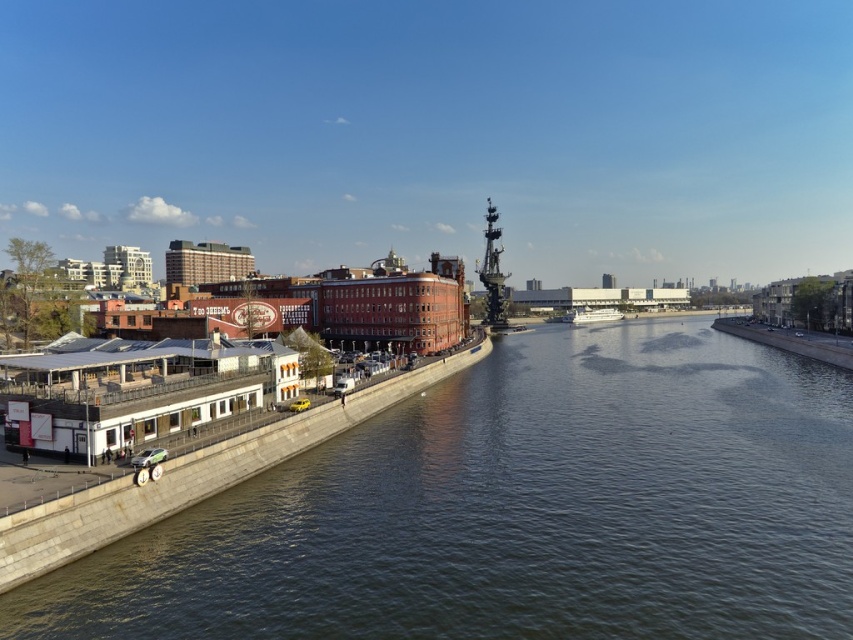
Is dark green water at center closer to camera compared to white glossy boat at center-right?

Yes, dark green water at center is in front of white glossy boat at center-right.

Consider the image. Is dark green water at center wider than white glossy boat at center-right?

Yes, dark green water at center is wider than white glossy boat at center-right.

Describe the element at coordinates (517, 509) in the screenshot. I see `dark green water at center` at that location.

Find the location of a particular element. The width and height of the screenshot is (853, 640). dark green water at center is located at coordinates (517, 509).